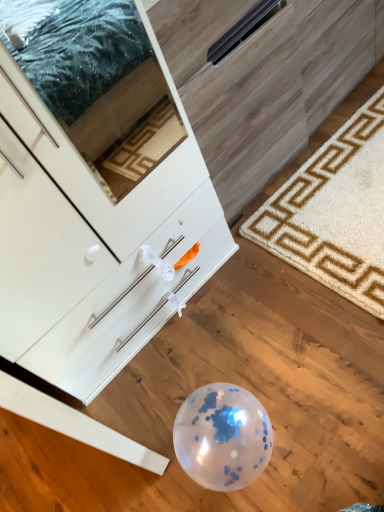
Question: Is white textured rug at lower right wider or thinner than white glossy cabinet at lower left?

Choices:
 (A) wide
 (B) thin

Answer: (B)

Question: Is white textured rug at lower right inside the boundaries of white glossy cabinet at lower left, or outside?

Choices:
 (A) outside
 (B) inside

Answer: (B)

Question: From the image's perspective, is white textured rug at lower right located above or below white glossy cabinet at lower left?

Choices:
 (A) above
 (B) below

Answer: (A)

Question: From their relative heights in the image, would you say white glossy cabinet at lower left is taller or shorter than white textured rug at lower right?

Choices:
 (A) tall
 (B) short

Answer: (A)

Question: Considering the positions of point (66, 92) and point (314, 216), is point (66, 92) closer or farther from the camera than point (314, 216)?

Choices:
 (A) closer
 (B) farther

Answer: (B)

Question: Based on their positions, is white glossy cabinet at lower left located to the left or right of white textured rug at lower right?

Choices:
 (A) left
 (B) right

Answer: (A)

Question: From the image's perspective, relative to white textured rug at lower right, is white glossy cabinet at lower left above or below?

Choices:
 (A) above
 (B) below

Answer: (B)